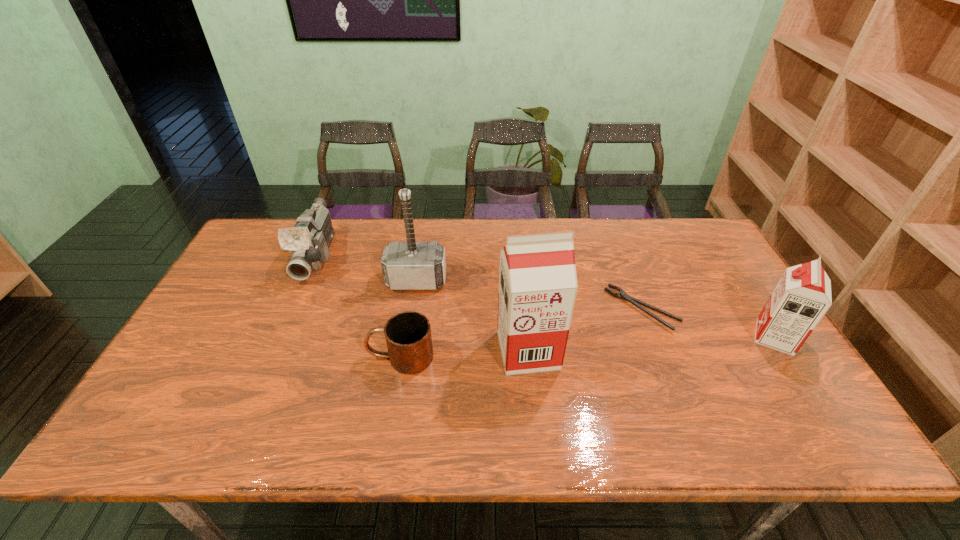
Given the evenly spaced soya milks in the image, where should an extra soya milk be added on the left to preserve the spacing? Please point to a vacant space. Please provide its 2D coordinates. Your answer should be formatted as a tuple, i.e. [(x, y)], where the tuple contains the x and y coordinates of a point satisfying the conditions above.

[(267, 364)]